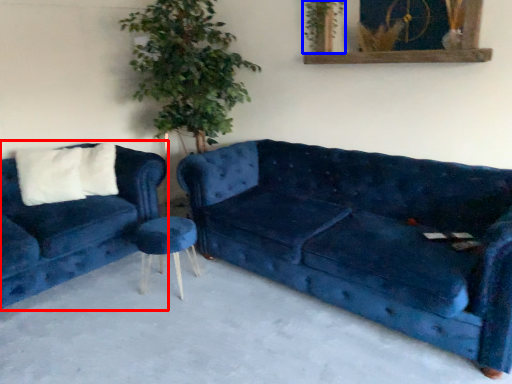
Question: Which point is further to the camera, studio couch (highlighted by a red box) or plant (highlighted by a blue box)?

Choices:
 (A) studio couch
 (B) plant

Answer: (B)